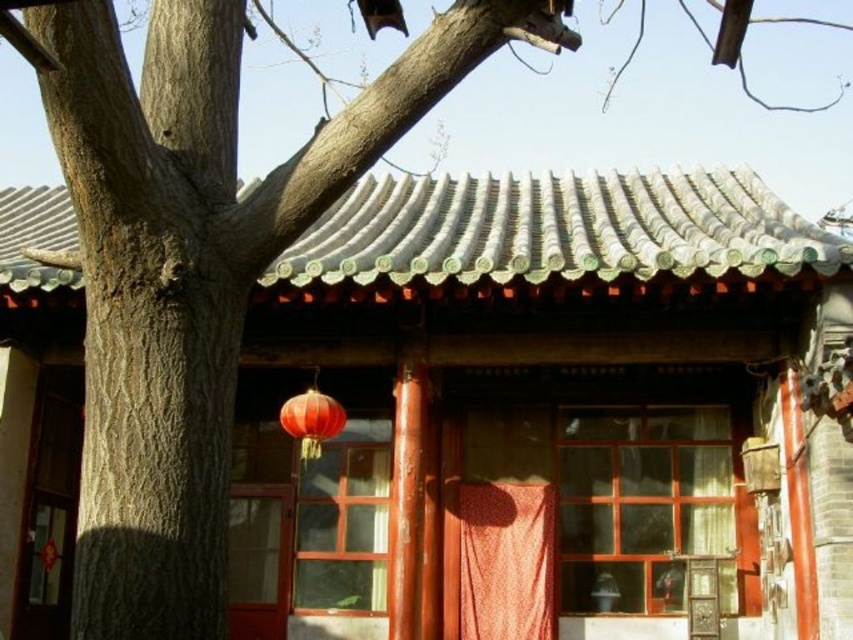
Consider the image. Who is taller, orange fabric curtain at center or wooden door at center?

Standing taller between the two is wooden door at center.

Which is in front, point (532, 502) or point (285, 540)?

Positioned in front is point (532, 502).

Is point (552, 620) farther from camera compared to point (238, 612)?

No, (552, 620) is closer to viewer.

In order to click on orange fabric curtain at center in this screenshot , I will do `click(506, 561)`.

Is orange fabric curtain at center positioned before matte red lantern at center?

No, orange fabric curtain at center is behind matte red lantern at center.

Is point (468, 541) in front of point (308, 449)?

No, it is not.

Is point (483, 492) more distant than point (286, 403)?

Yes, it is.

Locate an element on the screen. The width and height of the screenshot is (853, 640). orange fabric curtain at center is located at coordinates (506, 561).

Which is more to the right, wooden door at lower left or matte red lantern at center?

matte red lantern at center

Can you confirm if wooden door at lower left is positioned above matte red lantern at center?

Actually, wooden door at lower left is below matte red lantern at center.

What do you see at coordinates (48, 508) in the screenshot?
I see `wooden door at lower left` at bounding box center [48, 508].

Locate an element on the screen. The height and width of the screenshot is (640, 853). wooden door at lower left is located at coordinates (48, 508).